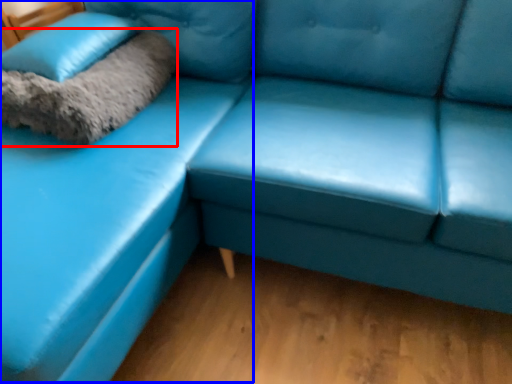
Question: Which of the following is the farthest to the observer, blanket (highlighted by a red box) or couch (highlighted by a blue box)?

Choices:
 (A) blanket
 (B) couch

Answer: (A)